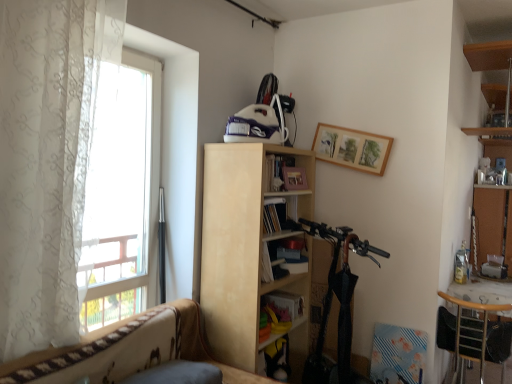
Locate an element on the screen. This screenshot has width=512, height=384. free space above wooden picture frame at upper center (from a real-world perspective) is located at coordinates (348, 125).